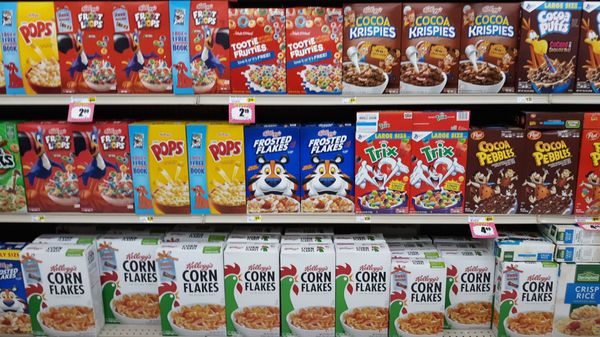
The height and width of the screenshot is (337, 600). Identify the location of fruit loops cereal box. (198, 40), (136, 56), (99, 59), (87, 178), (45, 173).